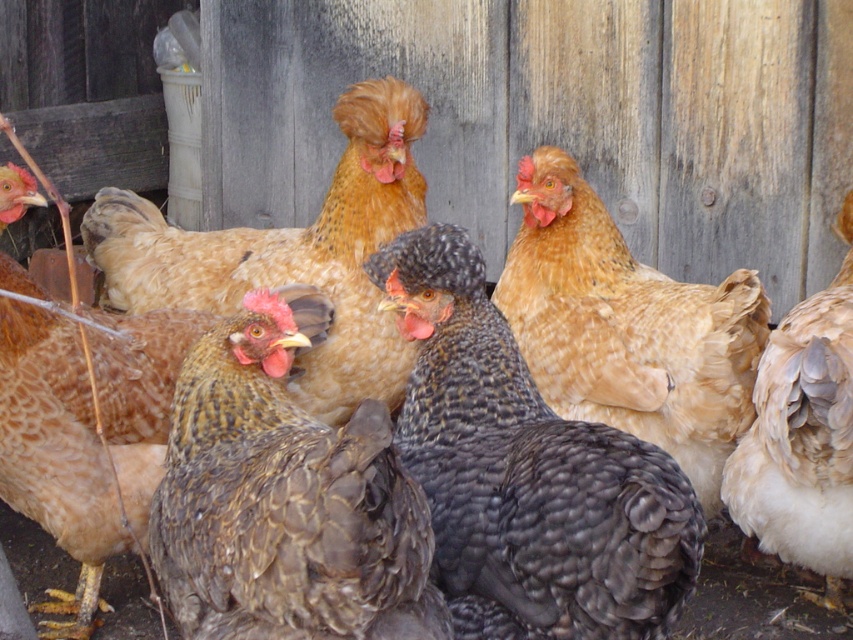
Who is more forward, (509, 333) or (187, 369)?

Point (187, 369) is in front.

Which is behind, point (561, 490) or point (265, 460)?

Point (561, 490)

The height and width of the screenshot is (640, 853). In order to click on dark grey textured chicken at center in this screenshot , I will do `click(526, 472)`.

Which is more to the right, dark brown textured feathers at center or brown speckled feathers at left?

From the viewer's perspective, dark brown textured feathers at center appears more on the right side.

This screenshot has height=640, width=853. What do you see at coordinates (283, 502) in the screenshot?
I see `dark brown textured feathers at center` at bounding box center [283, 502].

Which is behind, point (183, 492) or point (22, 470)?

The point (22, 470) is behind.

Identify the location of dark brown textured feathers at center. The width and height of the screenshot is (853, 640). (283, 502).

Does point (612, 472) come in front of point (653, 272)?

Yes.

Does dark grey textured chicken at center appear on the right side of golden feathered chicken at center?

Incorrect, dark grey textured chicken at center is not on the right side of golden feathered chicken at center.

Between point (653, 449) and point (618, 385), which one is positioned in front?

Point (653, 449)

In order to click on dark grey textured chicken at center in this screenshot , I will do [526, 472].